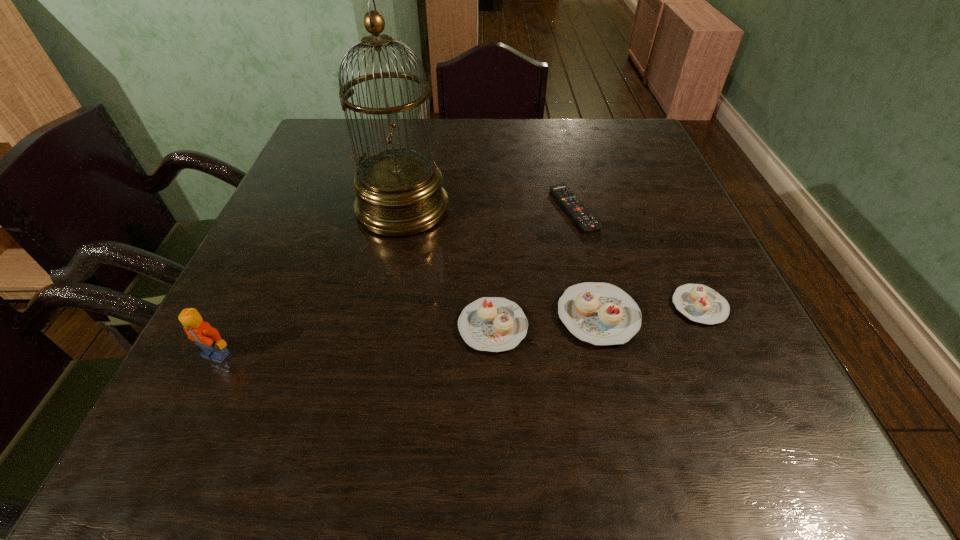
Where is `vacant place for an extra cupcake on the left`? vacant place for an extra cupcake on the left is located at coordinates (383, 338).